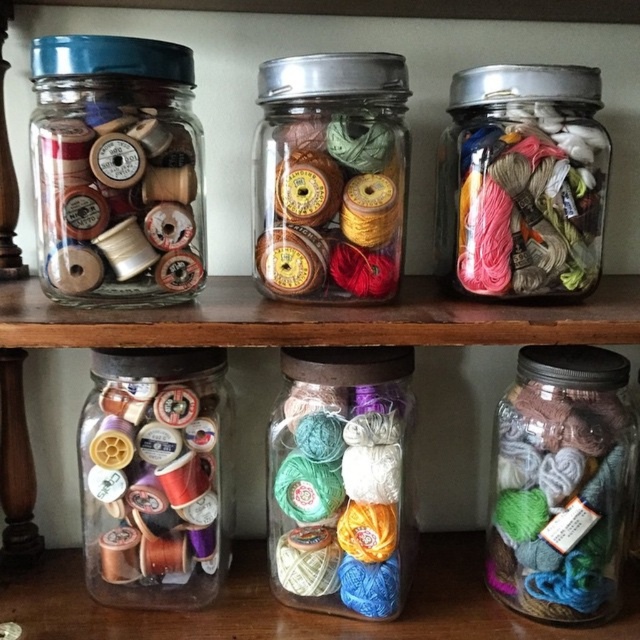
You are organizing a sewing kit and need to place the metallic silver thread at upper right and the matte brown spools at center into a drawer. Based on their positions in the image, which item is closer to the bottom of the drawer when arranged similarly?

The metallic silver thread at upper right is located below matte brown spools at center, so when arranged similarly in the drawer, the metallic silver thread at upper right will be closer to the bottom of the drawer.

You are standing in front of the shelves with the jars. You need to reach a specific point to grab a jar. If you first reach point (561, 156) and then point (390, 70), will you be moving forward or backward?

Moving from point (561, 156) to point (390, 70) would mean moving forward since point (561, 156) is behind point (390, 70).

You are organizing a sewing kit and need to know which takes up more space between the matte plastic spools at upper left and the metallic silver thread at upper right. Which one requires more space?

The metallic silver thread at upper right requires more space because it occupies more space than the matte plastic spools at upper left.